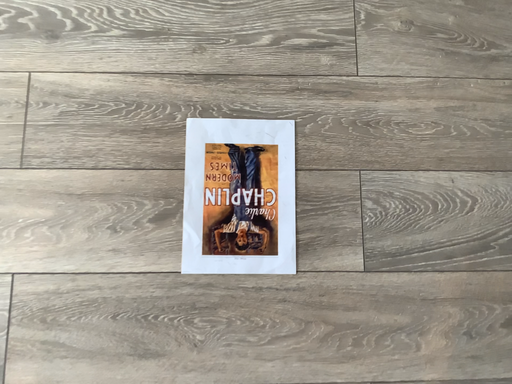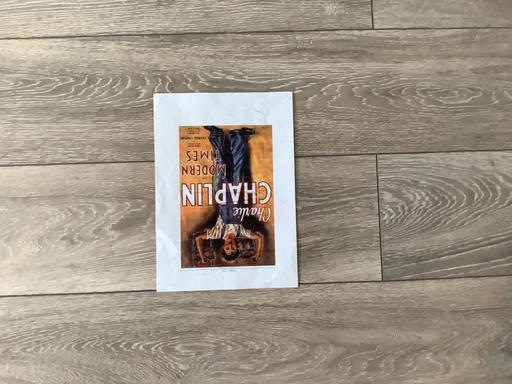
Question: How did the camera likely rotate when shooting the video?

Choices:
 (A) rotated upward
 (B) rotated downward

Answer: (B)